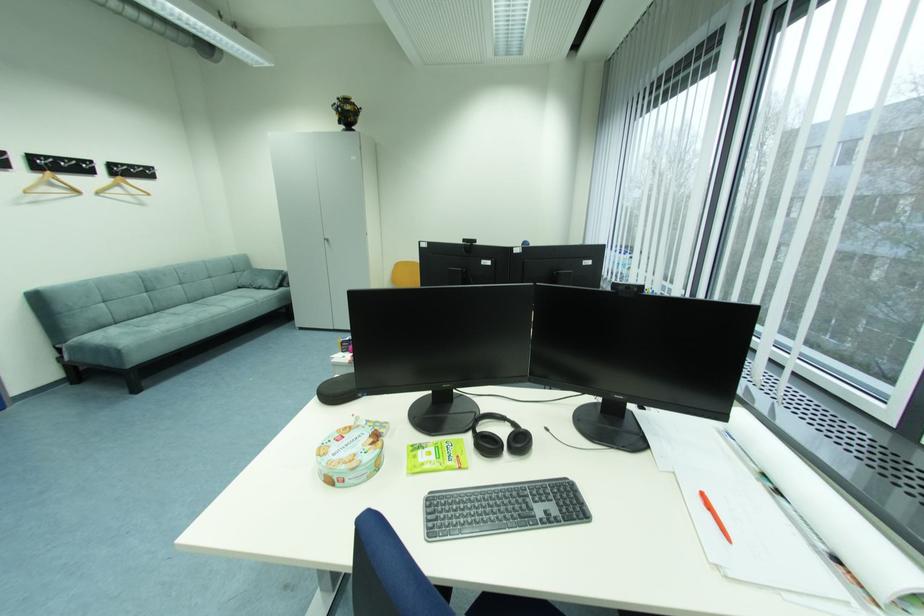
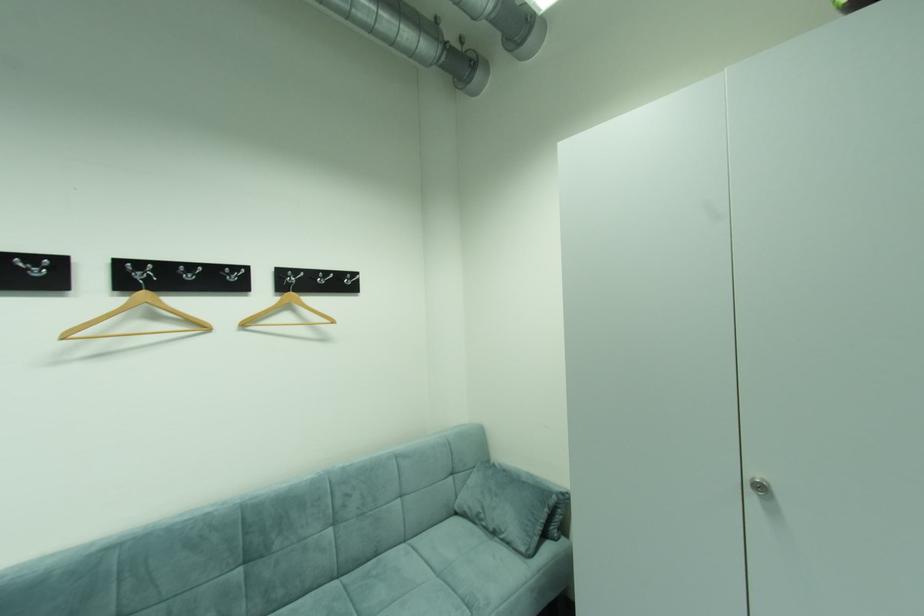
In the second image, find the point that corresponds to [246,288] in the first image.

(464, 514)